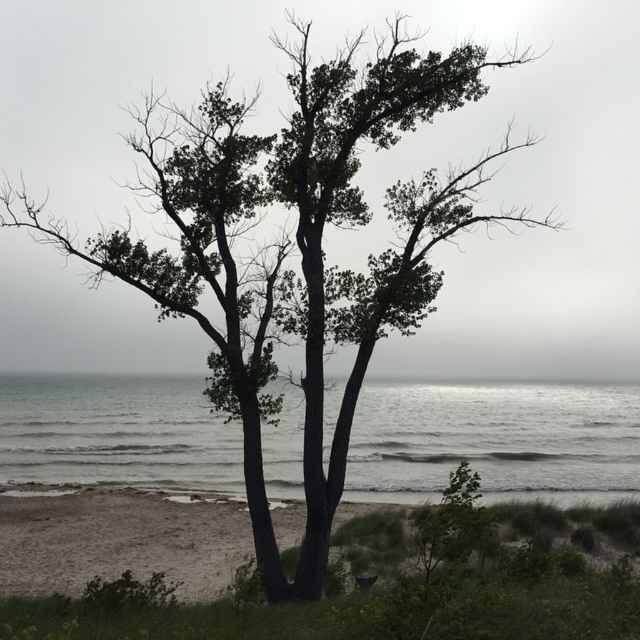
You are a photographer planning to capture the entire scene of the gray water at center and the sandy brown sand at lower center in one shot. Based on their sizes, which area should you focus on to ensure both are visible without cropping?

The gray water at center has a larger size compared to sandy brown sand at lower center, so you should focus on the gray water at center to ensure both areas are visible without cropping.

You are standing on the shore looking at the gray water at center and the sandy brown sand at lower center. Which one is closer to your feet?

The sandy brown sand at lower center is closer to your feet because it is at the lower part of the scene, which typically represents the foreground in such images.

You are standing at the shoreline in the image and want to step onto the sandy brown sand at lower center. Which direction should you move relative to the gray water at center?

You should move downward from the gray water at center to reach the sandy brown sand at lower center since the gray water at center is located above sandy brown sand at lower center.